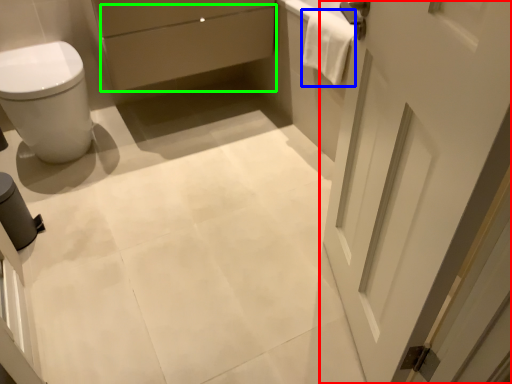
Question: Considering the real-world distances, which object is farthest from door (highlighted by a red box)? material (highlighted by a blue box) or drawer (highlighted by a green box)?

Choices:
 (A) material
 (B) drawer

Answer: (B)